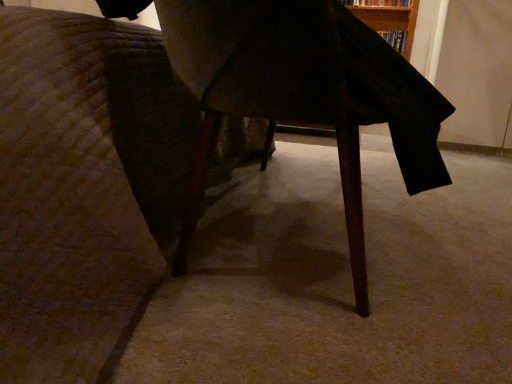
Question: Can you confirm if hardcover book at upper right is wider than wooden table at center?

Choices:
 (A) yes
 (B) no

Answer: (B)

Question: Would you say hardcover book at upper right contains wooden table at center?

Choices:
 (A) yes
 (B) no

Answer: (B)

Question: Does hardcover book at upper right lie behind wooden table at center?

Choices:
 (A) yes
 (B) no

Answer: (A)

Question: Is hardcover book at upper right to the left of wooden table at center from the viewer's perspective?

Choices:
 (A) yes
 (B) no

Answer: (B)

Question: From a real-world perspective, is hardcover book at upper right on top of wooden table at center?

Choices:
 (A) no
 (B) yes

Answer: (B)

Question: In terms of width, does hardcover book at upper right look wider or thinner when compared to wooden table at center?

Choices:
 (A) wide
 (B) thin

Answer: (B)

Question: Looking at the image, does hardcover book at upper right seem bigger or smaller compared to wooden table at center?

Choices:
 (A) big
 (B) small

Answer: (B)

Question: From a real-world perspective, is hardcover book at upper right positioned above or below wooden table at center?

Choices:
 (A) below
 (B) above

Answer: (B)

Question: From the image's perspective, is hardcover book at upper right positioned above or below wooden table at center?

Choices:
 (A) below
 (B) above

Answer: (B)

Question: From a real-world perspective, is hardcover book at upper right positioned above or below wooden table at center?

Choices:
 (A) above
 (B) below

Answer: (A)

Question: From the image's perspective, is hardcover book at upper right positioned above or below wooden table at center?

Choices:
 (A) below
 (B) above

Answer: (B)

Question: Considering the positions of point (392, 39) and point (305, 57), is point (392, 39) closer or farther from the camera than point (305, 57)?

Choices:
 (A) farther
 (B) closer

Answer: (A)

Question: Relative to wooden table at center, is hardcover book at upper right in front or behind?

Choices:
 (A) behind
 (B) front

Answer: (A)

Question: From their relative heights in the image, would you say wooden table at center is taller or shorter than hardcover book at upper right?

Choices:
 (A) tall
 (B) short

Answer: (A)

Question: From a real-world perspective, is wooden table at center positioned above or below hardcover book at upper right?

Choices:
 (A) above
 (B) below

Answer: (B)